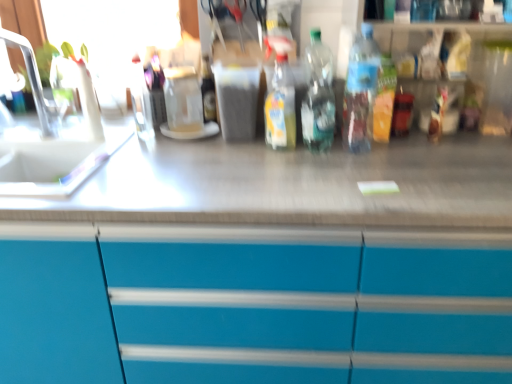
At what (x,y) coordinates should I click in order to perform the action: click on free space to the left of clear plastic bottle at upper center, marked as the 1th bottle in a left-to-right arrangement. Please return your answer as a coordinate pair (x, y). Looking at the image, I should click on (106, 134).